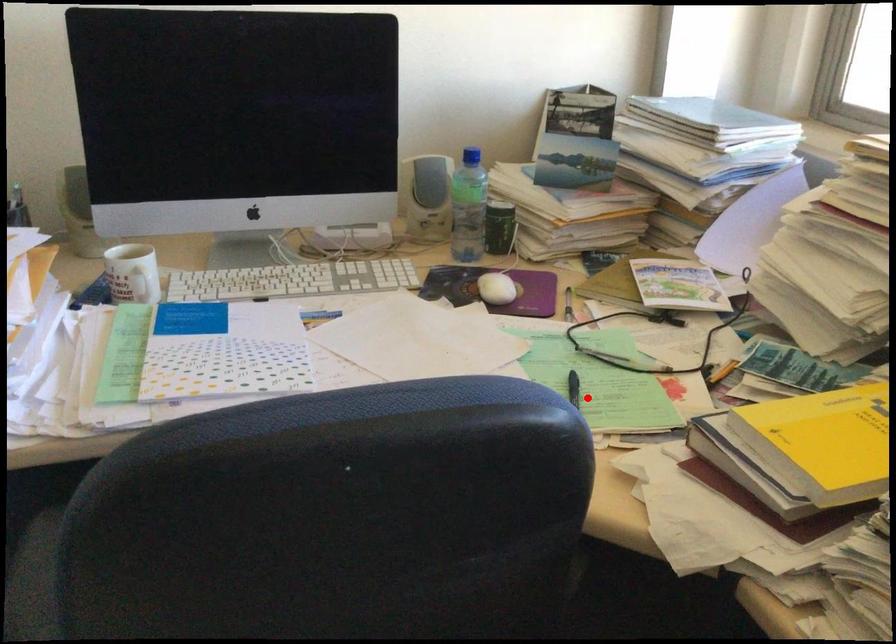
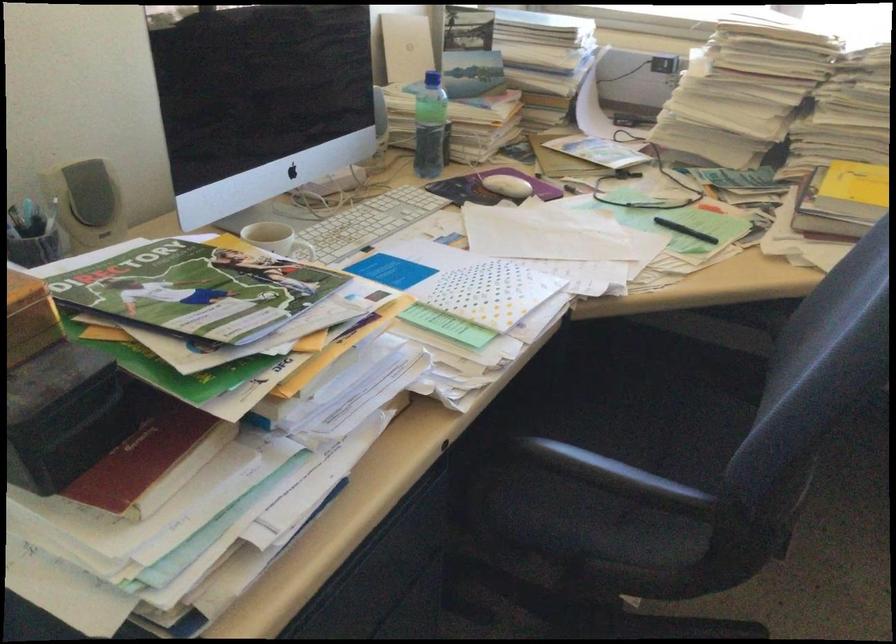
Question: I am providing you with two images of the same scene from different viewpoints. In image1, a red point is highlighted. Considering the same 3D point in image2, which of the following is correct?

Choices:
 (A) It is closer
 (B) It is farther

Answer: (B)